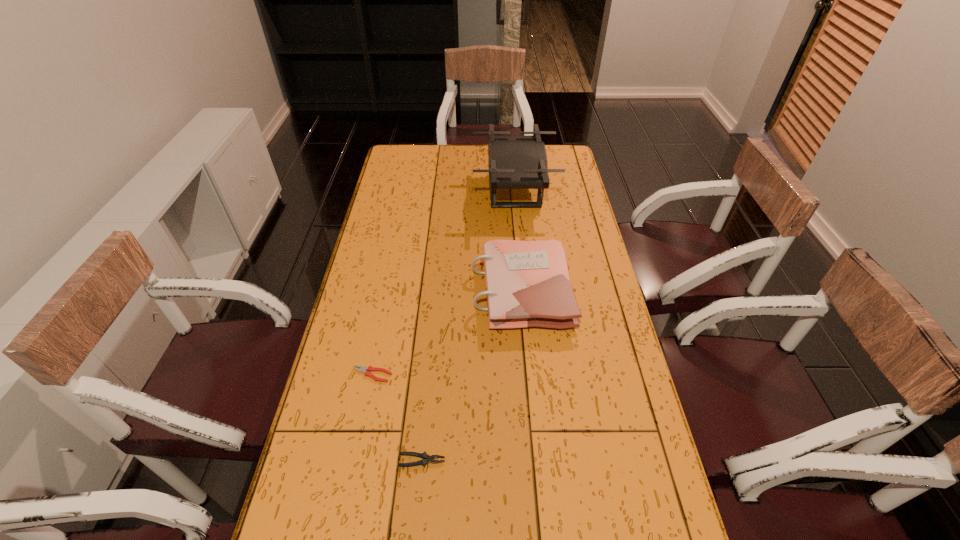
I want to click on vacant space situated 0.110m with a camera mounted on the underside of the tallest object, so click(x=447, y=191).

Where is `free location located 0.170m on the back of the third nearest object`? free location located 0.170m on the back of the third nearest object is located at coordinates (515, 225).

The image size is (960, 540). In order to click on free space located at the gripping part of the second object from left to right in this screenshot , I will do `click(593, 461)`.

I want to click on free space located 0.130m on the right of the third farthest object, so click(x=439, y=375).

The width and height of the screenshot is (960, 540). I want to click on object located at the far edge, so 515,162.

This screenshot has width=960, height=540. What are the coordinates of `object located in the left edge section of the desktop` in the screenshot? It's located at (366, 370).

At what (x,y) coordinates should I click in order to perform the action: click on drone that is at the right edge. Please return your answer as a coordinate pair (x, y). Looking at the image, I should click on (515, 162).

Locate an element on the screen. This screenshot has width=960, height=540. phonebook that is at the right edge is located at coordinates (527, 282).

Find the location of a particular element. The image size is (960, 540). object that is at the far right corner is located at coordinates (515, 162).

I want to click on vacant space at the left edge of the desktop, so click(x=414, y=186).